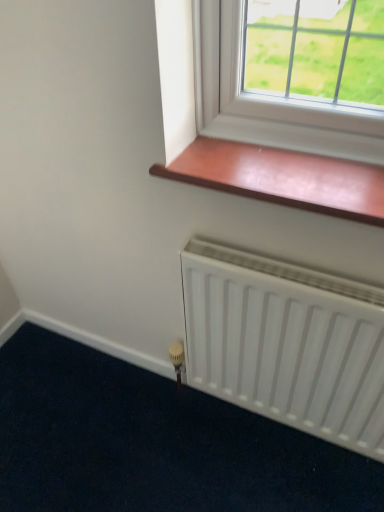
Locate an element on the screen. The height and width of the screenshot is (512, 384). empty space that is ontop of wooden at upper center is located at coordinates pos(263,165).